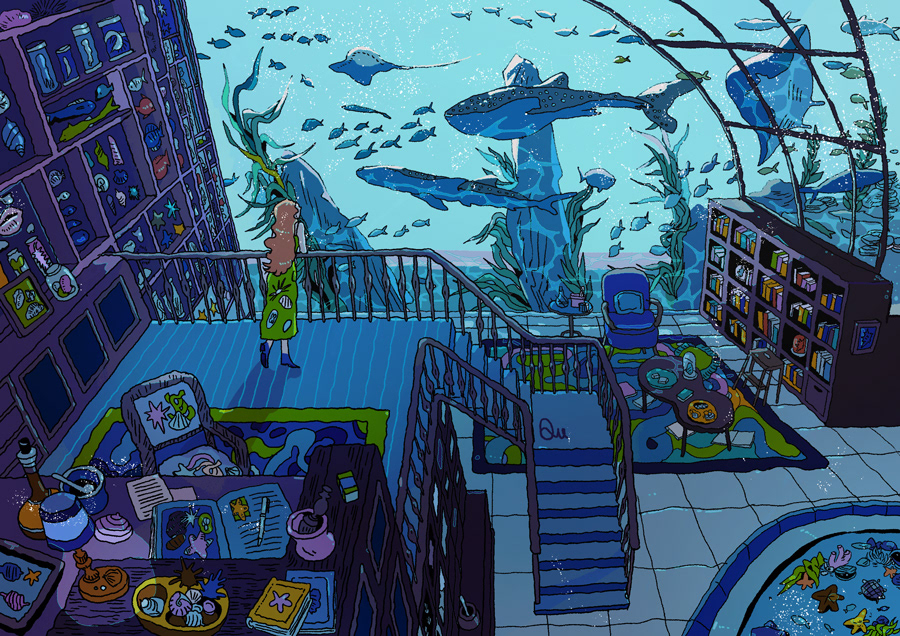
Where is `stairs`? stairs is located at coordinates (608, 543), (475, 362).